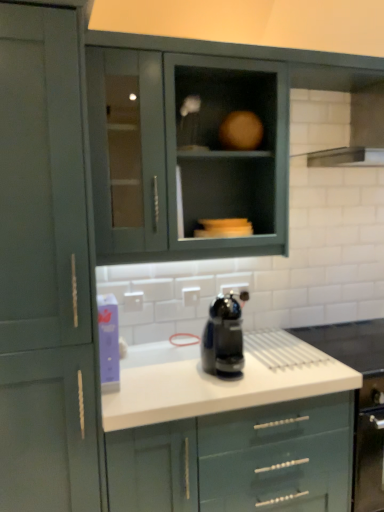
Find the location of a particular element. This screenshot has width=384, height=512. vacant space in front of black glossy coffee maker at center is located at coordinates (234, 389).